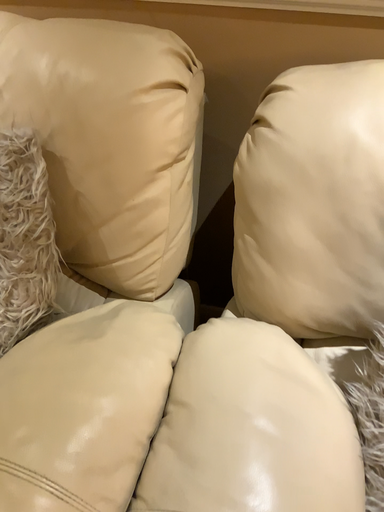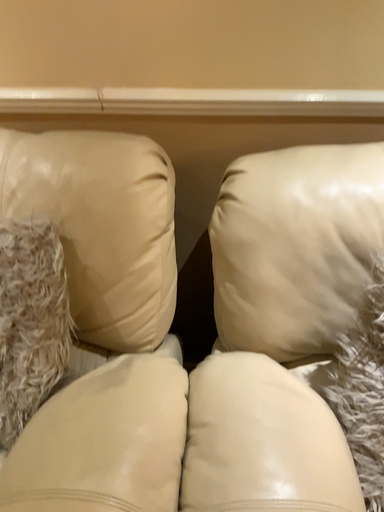
Question: How did the camera likely rotate when shooting the video?

Choices:
 (A) rotated right
 (B) rotated left

Answer: (A)